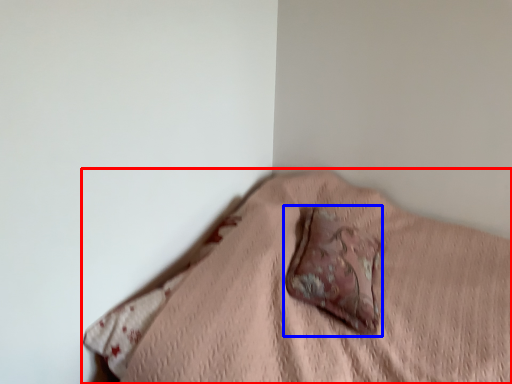
Question: Which object is closer to the camera taking this photo, furniture (highlighted by a red box) or throw pillow (highlighted by a blue box)?

Choices:
 (A) furniture
 (B) throw pillow

Answer: (A)